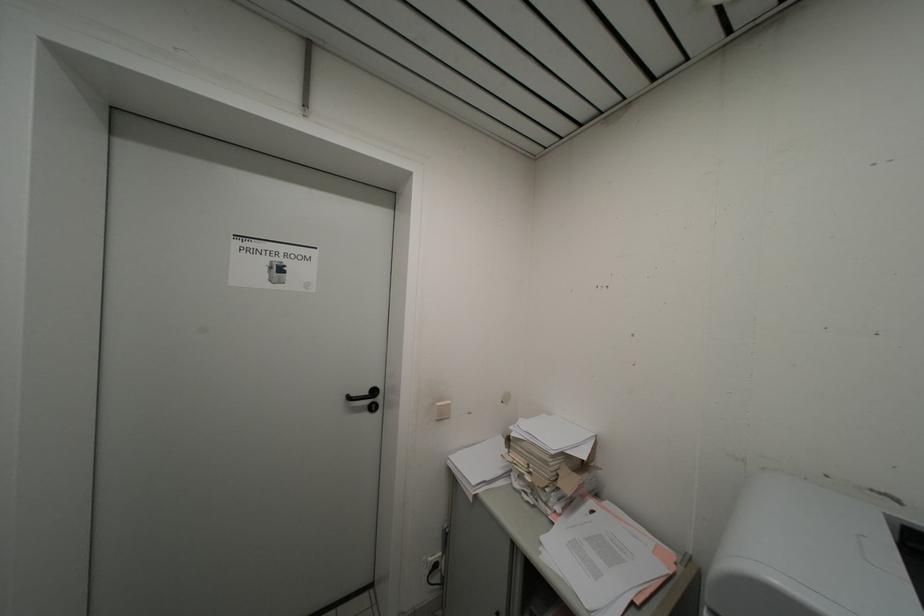
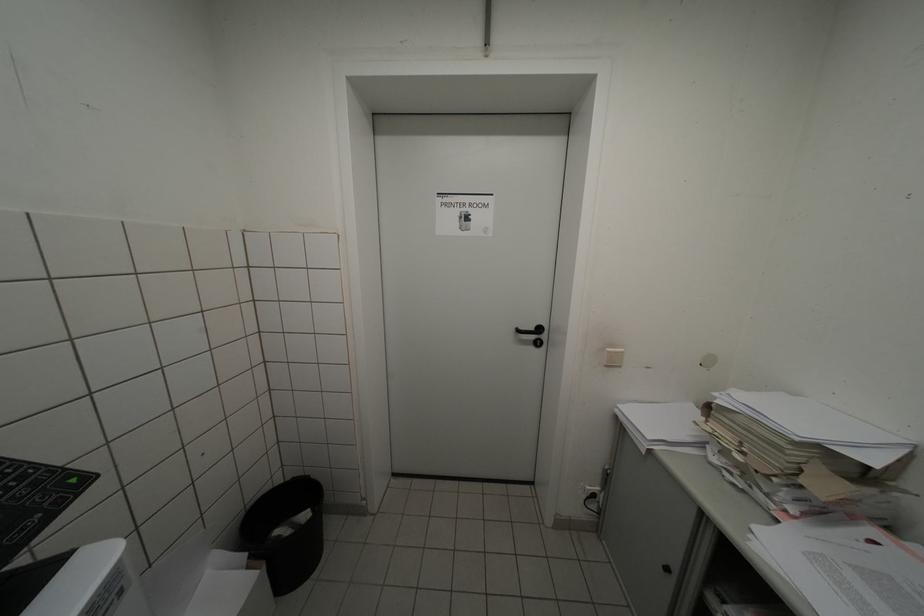
Where in the second image is the point corresponding to point (445, 407) from the first image?

(615, 352)